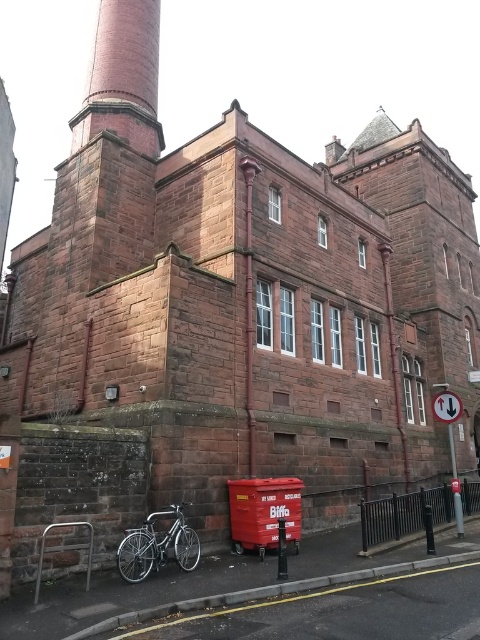
You are standing in front of the historic building and want to park your bicycle so it aligns with the red brick chimney at upper left. Which direction should you move the silver metallic bicycle at lower left to align it with the chimney?

The red brick chimney at upper left is already to the left of the silver metallic bicycle at lower left, so moving the silver metallic bicycle at lower left further to the left would align it with the chimney.

You are standing in front of the historic building and notice the red brick chimney at upper left and the silver metallic bicycle at lower left. Which object is taller?

The red brick chimney at upper left is taller than the silver metallic bicycle at lower left according to the description.